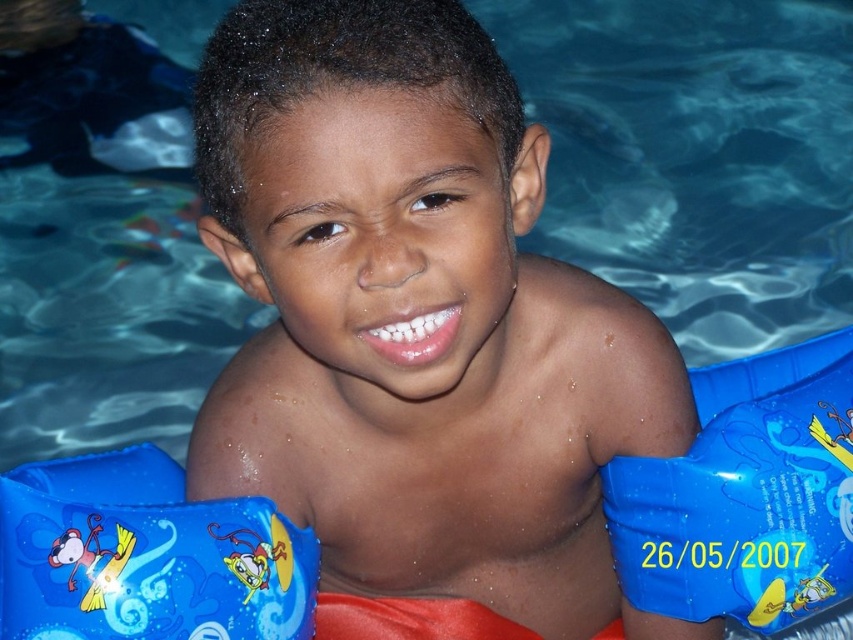
You are a photographer trying to capture a closeup shot of the blue rubber arm bands at center. Given that your camera has a minimum focusing distance of 40 inches, will you be able to take the photo without moving closer?

The blue rubber arm bands at center is 38.08 inches away from camera. Since the minimum focusing distance is 40 inches, the photographer cannot focus on the blue rubber arm bands at center without moving back to increase the distance.

The boy is playing in the pool with his blue inflatable arm band at right and blue inflatable arm bands at lower left. Which of these items is positioned higher in the image?

The blue inflatable arm band at right is positioned higher than the blue inflatable arm bands at lower left in the image.

A lifeguard needs to throw a rescue buoy to the boy at point (326, 305). The buoy is 1 meter in diameter. Will it reach him without hitting the edge of the pool?

The rescue buoy is 1 meter in diameter, and the distance between the lifeguard and the boy at point (326, 305) is 1.05 meters. Since the distance is slightly longer than the buoy can reach, it might not reach him without hitting the edge of the pool.